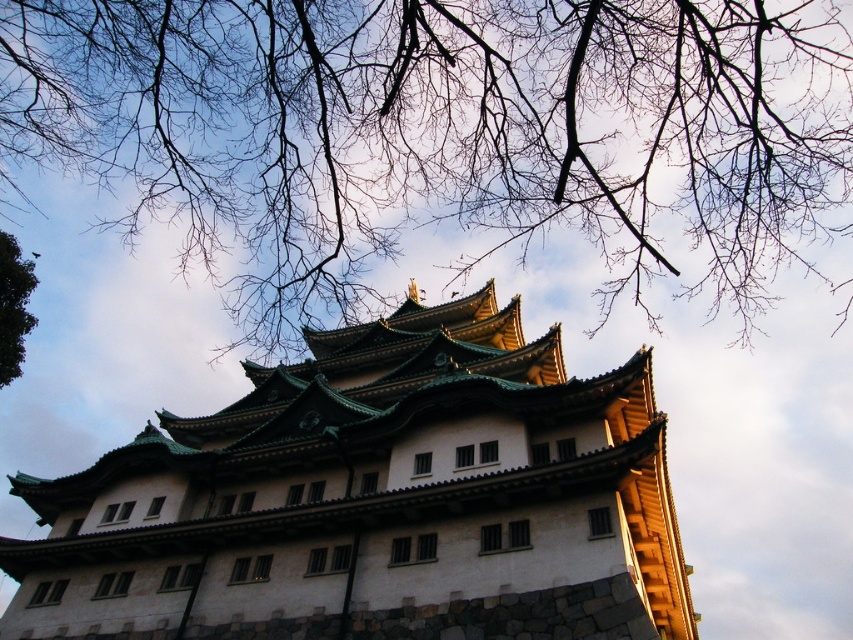
You are standing in front of the traditional multi tiered building. You see a white stone tower at center and a green leafy tree at upper left. Which object is positioned to the right side of the other?

The white stone tower at center is positioned to the right of green leafy tree at upper left according to the description.

From the picture: You are standing on the ground floor of the building and want to look up at both the brown bark tree at upper center and the white stone tower at center. Which object will you see higher in your field of view?

The brown bark tree at upper center is located above the white stone tower at center, so it will appear higher in your field of view.

You are an architect analyzing the traditional building in the image. You notice two trees in the upper part of the scene. Which tree has a larger size between the brown bark tree at upper center and the green leafy tree at upper left?

The brown bark tree at upper center is bigger than the green leafy tree at upper left.